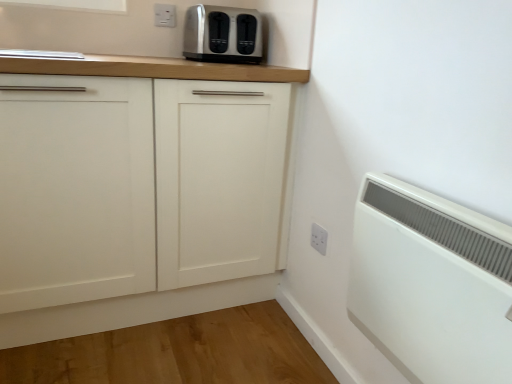
Question: Can you see white matte cabinet at center touching white plastic radiator at lower right?

Choices:
 (A) yes
 (B) no

Answer: (B)

Question: From the image's perspective, is white matte cabinet at center over white plastic radiator at lower right?

Choices:
 (A) yes
 (B) no

Answer: (A)

Question: Is white matte cabinet at center not within white plastic radiator at lower right?

Choices:
 (A) yes
 (B) no

Answer: (A)

Question: From a real-world perspective, is white matte cabinet at center on white plastic radiator at lower right?

Choices:
 (A) no
 (B) yes

Answer: (A)

Question: Is white matte cabinet at center in front of white plastic radiator at lower right?

Choices:
 (A) no
 (B) yes

Answer: (A)

Question: Is white plastic electric outlet at upper center, marked as the 1th electric outlet in a left-to-right arrangement, to the left or to the right of white matte cabinet at center in the image?

Choices:
 (A) left
 (B) right

Answer: (B)

Question: Considering their positions, is white plastic electric outlet at upper center, arranged as the first electric outlet when viewed from the back, located in front of or behind white matte cabinet at center?

Choices:
 (A) front
 (B) behind

Answer: (B)

Question: From a real-world perspective, is white plastic electric outlet at upper center, arranged as the first electric outlet when viewed from the back, above or below white matte cabinet at center?

Choices:
 (A) below
 (B) above

Answer: (B)

Question: From the image's perspective, relative to white matte cabinet at center, is white plastic electric outlet at upper center, marked as the 1th electric outlet in a left-to-right arrangement, above or below?

Choices:
 (A) above
 (B) below

Answer: (A)

Question: Does point (385, 271) appear closer or farther from the camera than point (86, 274)?

Choices:
 (A) closer
 (B) farther

Answer: (A)

Question: From a real-world perspective, is white plastic radiator at lower right above or below white matte cabinet at center?

Choices:
 (A) below
 (B) above

Answer: (B)

Question: Is white plastic radiator at lower right to the left or to the right of white matte cabinet at center in the image?

Choices:
 (A) right
 (B) left

Answer: (A)

Question: Considering the positions of white plastic radiator at lower right and white matte cabinet at center in the image, is white plastic radiator at lower right bigger or smaller than white matte cabinet at center?

Choices:
 (A) big
 (B) small

Answer: (B)

Question: Is white plastic electric outlet at center, the 1th electric outlet from the bottom, to the left or to the right of white plastic radiator at lower right in the image?

Choices:
 (A) left
 (B) right

Answer: (A)

Question: Relative to white plastic radiator at lower right, is white plastic electric outlet at center, which ranks as the 1th electric outlet in front-to-back order, in front or behind?

Choices:
 (A) behind
 (B) front

Answer: (A)